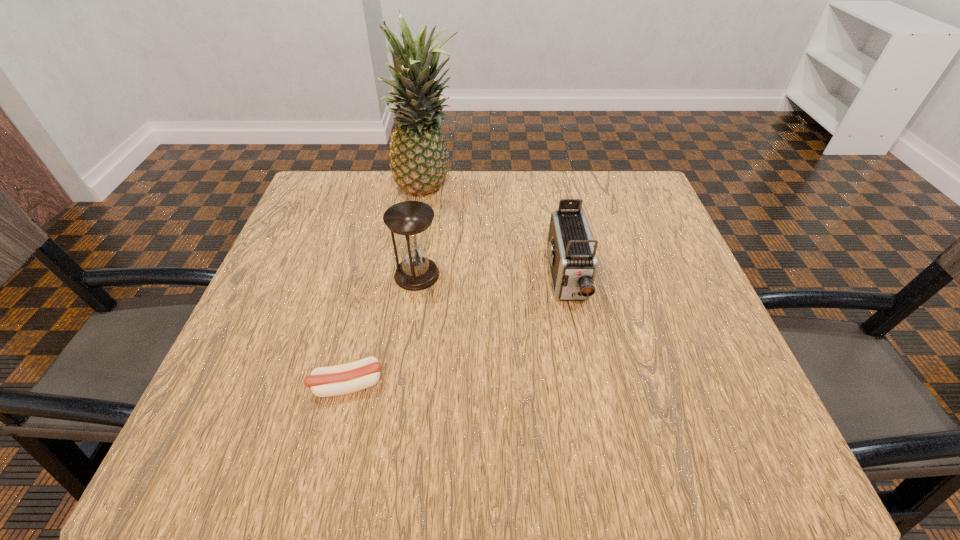
In order to click on vacant space that satisfies the following two spatial constraints: 1. on the front side of the pineapple; 2. on the right side of the hourglass in this screenshot , I will do `click(415, 274)`.

Identify the location of vacant space that satisfies the following two spatial constraints: 1. on the back side of the pineapple; 2. on the right side of the shortest object. The width and height of the screenshot is (960, 540). (395, 191).

I want to click on free space that satisfies the following two spatial constraints: 1. on the front side of the pineapple; 2. on the left side of the hourglass, so click(415, 274).